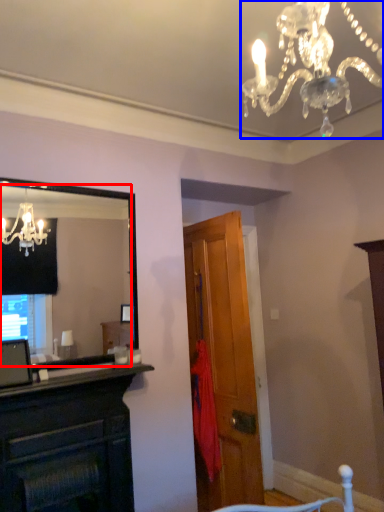
Question: Which point is closer to the camera, mirror (highlighted by a red box) or lamp (highlighted by a blue box)?

Choices:
 (A) mirror
 (B) lamp

Answer: (B)